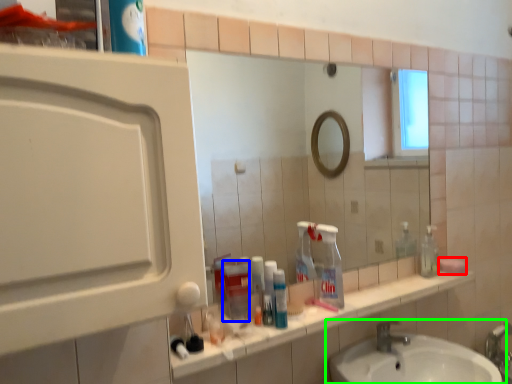
Question: Considering the real-world distances, which object is farthest from soap (highlighted by a red box)? bottle (highlighted by a blue box) or sink (highlighted by a green box)?

Choices:
 (A) bottle
 (B) sink

Answer: (A)